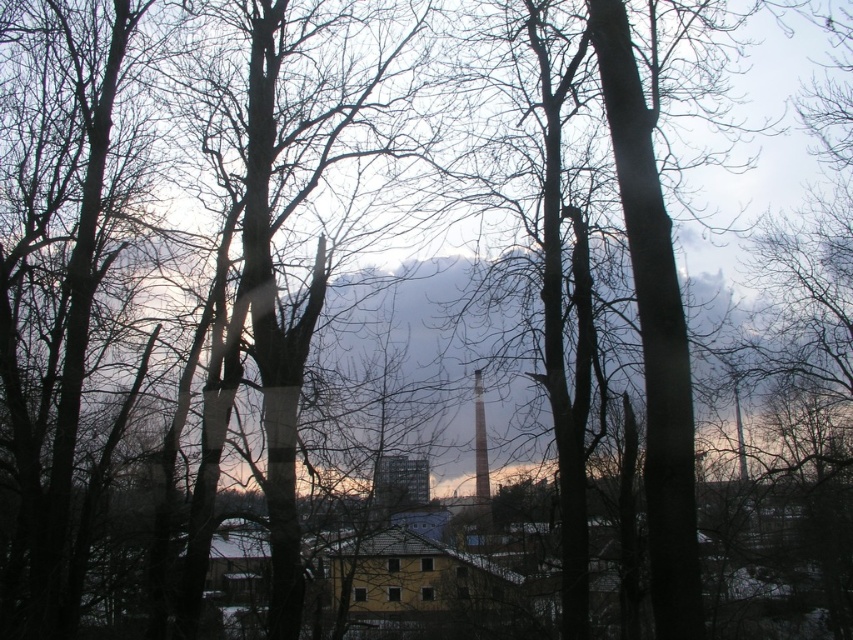
Can you confirm if smooth white tower at center is shorter than smooth gray chimney at center?

No, smooth white tower at center is not shorter than smooth gray chimney at center.

Is smooth white tower at center to the right of smooth gray chimney at center from the viewer's perspective?

Yes, smooth white tower at center is to the right of smooth gray chimney at center.

This screenshot has width=853, height=640. What do you see at coordinates (480, 451) in the screenshot?
I see `smooth white tower at center` at bounding box center [480, 451].

Locate an element on the screen. This screenshot has height=640, width=853. smooth white tower at center is located at coordinates pyautogui.click(x=480, y=451).